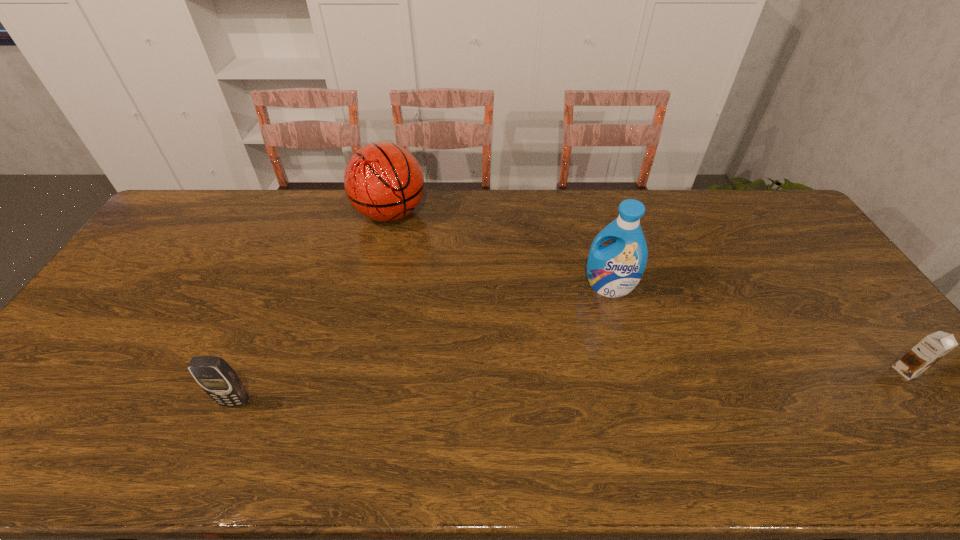
You are a GUI agent. You are given a task and a screenshot of the screen. Output one action in this format:
    pyautogui.click(x=<x>, y=<y>)
    Task: Click on the free spot on the desktop that is between the leftmost object and the rightmost object and is positioned on the side with spill of the basketball
    Image resolution: width=960 pixels, height=540 pixels.
    Given the screenshot: What is the action you would take?
    pyautogui.click(x=501, y=389)

The width and height of the screenshot is (960, 540). Identify the location of free space on the desktop that is between the cellular telephone and the second nearest object and is positioned on the front-facing side of the detergent. (569, 386).